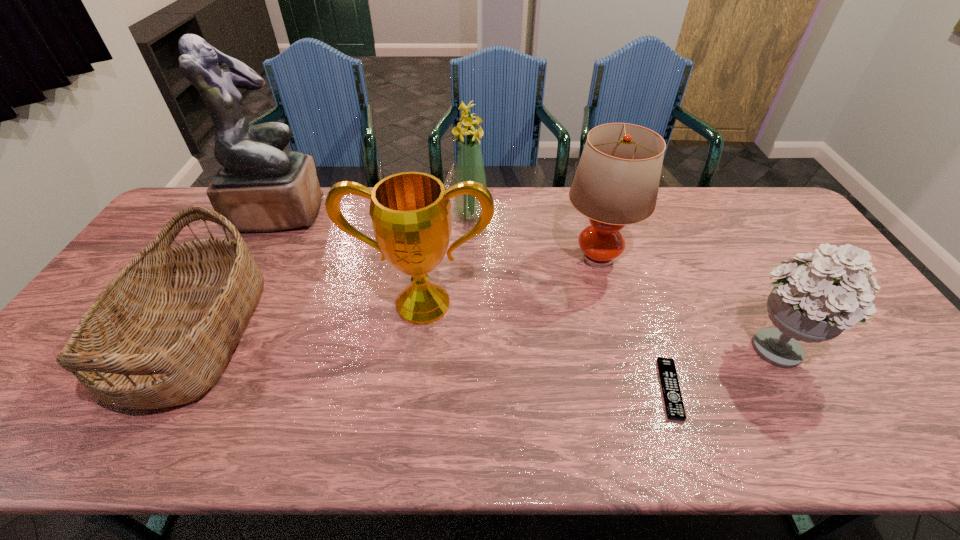
You are a GUI agent. You are given a task and a screenshot of the screen. Output one action in this format:
    pyautogui.click(x=<x>, y=<y>)
    Task: Click on the object that is at the left edge
    This screenshot has width=960, height=540.
    Given the screenshot: What is the action you would take?
    pyautogui.click(x=160, y=334)

Where is `object that is at the near left corner`? The height and width of the screenshot is (540, 960). object that is at the near left corner is located at coordinates (160, 334).

What are the coordinates of `free point at the far edge` in the screenshot? It's located at (685, 216).

What are the coordinates of `free location at the near edge` in the screenshot? It's located at (540, 413).

This screenshot has width=960, height=540. Find the location of `free region at the right edge`. free region at the right edge is located at coordinates point(798,232).

At what (x,y) coordinates should I click in order to perform the action: click on vacant region between the lamp and the shortest object. Please return your answer as a coordinate pair (x, y). Looking at the image, I should click on point(634,323).

Locate an element on the screen. free spot between the award and the lamp is located at coordinates (510, 281).

The height and width of the screenshot is (540, 960). Identify the location of unoccupied position between the second shortest object and the shortest object. (432, 362).

This screenshot has height=540, width=960. What are the coordinates of `free space between the remote control and the award` in the screenshot? It's located at (546, 346).

Where is `unoccupied area between the sculpture and the award`? The height and width of the screenshot is (540, 960). unoccupied area between the sculpture and the award is located at coordinates (351, 258).